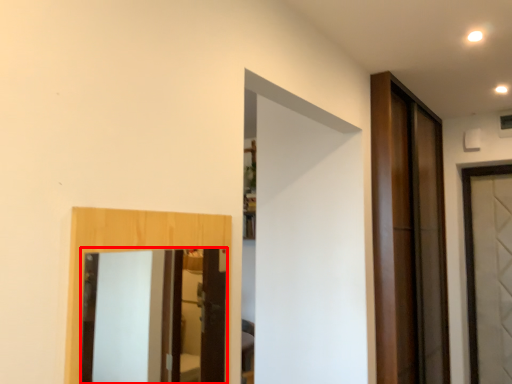
Question: From the image's perspective, where is mirror (annotated by the red box) located in relation to door in the image?

Choices:
 (A) above
 (B) below

Answer: (A)